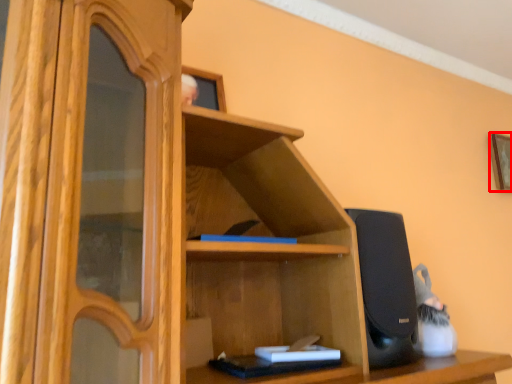
Question: From the image's perspective, considering the relative positions of picture frame (annotated by the red box) and book in the image provided, where is picture frame (annotated by the red box) located with respect to the staircase?

Choices:
 (A) below
 (B) above

Answer: (B)